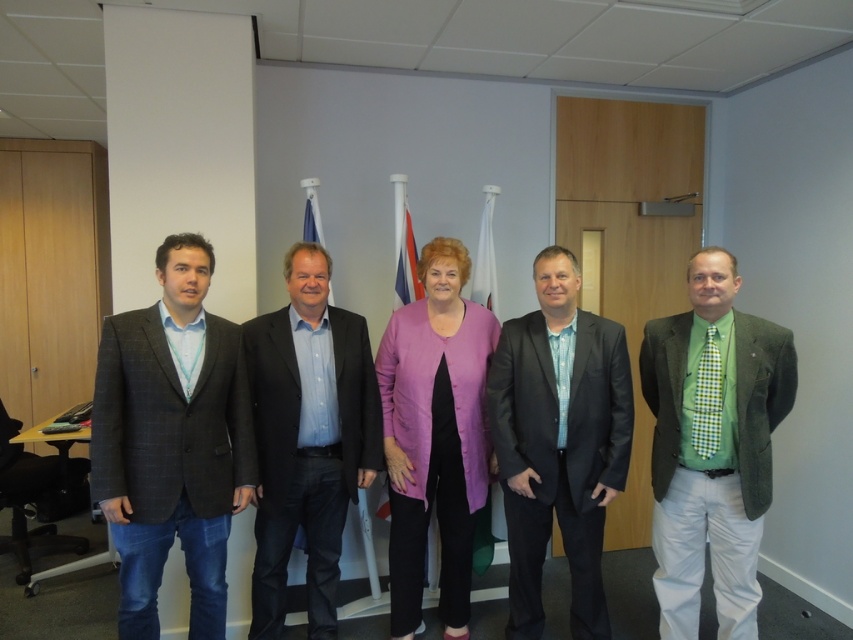
Question: From the image, what is the correct spatial relationship of matte black suit at center in relation to purple fabric jacket at center?

Choices:
 (A) left
 (B) right

Answer: (B)

Question: Which point is farther to the camera?

Choices:
 (A) (706, 476)
 (B) (166, 548)

Answer: (A)

Question: Does dark gray checkered suit at left have a smaller size compared to green plaid tie at right?

Choices:
 (A) yes
 (B) no

Answer: (B)

Question: Which object appears farthest from the camera in this image?

Choices:
 (A) purple fabric jacket at center
 (B) matte black suit at center
 (C) green plaid tie at right
 (D) dark gray checkered suit at left

Answer: (A)

Question: Which is nearer to the purple fabric jacket at center?

Choices:
 (A) matte black suit at center
 (B) blue shirt at center

Answer: (B)

Question: Is matte black suit at center below purple fabric jacket at center?

Choices:
 (A) yes
 (B) no

Answer: (B)